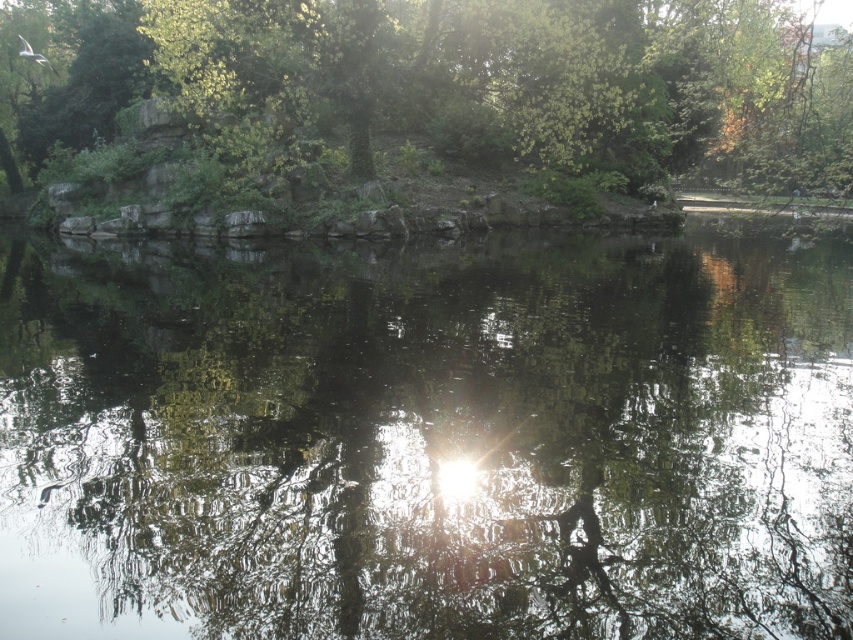
Is point (280, 461) positioned after point (670, 54)?

No, it is not.

Which is behind, point (651, 266) or point (85, 96)?

Point (85, 96)

You are a GUI agent. You are given a task and a screenshot of the screen. Output one action in this format:
    pyautogui.click(x=<x>, y=<y>)
    Task: Click on the transparent water at center
    The height and width of the screenshot is (640, 853).
    Given the screenshot: What is the action you would take?
    pyautogui.click(x=427, y=440)